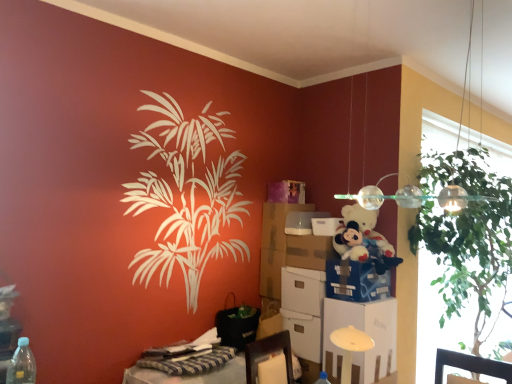
Question: Is brown cardboard box at center-right, marked as the 3th box in a top-to-bottom arrangement, facing towards blue cardboard box at center, the third box in the bottom-to-top sequence?

Choices:
 (A) no
 (B) yes

Answer: (A)

Question: Is blue cardboard box at center, which appears as the fourth box when viewed from the top, completely or partially inside brown cardboard box at center-right, marked as the 3th box in a top-to-bottom arrangement?

Choices:
 (A) no
 (B) yes

Answer: (A)

Question: Is brown cardboard box at center-right, arranged as the 4th box when ordered from the bottom, to the right of blue cardboard box at center, the third box in the bottom-to-top sequence, from the viewer's perspective?

Choices:
 (A) yes
 (B) no

Answer: (B)

Question: Considering the relative sizes of brown cardboard box at center-right, arranged as the 4th box when ordered from the bottom, and blue cardboard box at center, which appears as the fourth box when viewed from the top, in the image provided, is brown cardboard box at center-right, arranged as the 4th box when ordered from the bottom, shorter than blue cardboard box at center, which appears as the fourth box when viewed from the top,?

Choices:
 (A) yes
 (B) no

Answer: (A)

Question: Are brown cardboard box at center-right, arranged as the 4th box when ordered from the bottom, and blue cardboard box at center, the third box in the bottom-to-top sequence, far apart?

Choices:
 (A) no
 (B) yes

Answer: (A)

Question: Would you say fluffy white teddy bear at upper right is to the left or to the right of striped fabric desk at lower left in the picture?

Choices:
 (A) right
 (B) left

Answer: (A)

Question: From the image's perspective, is fluffy white teddy bear at upper right located above or below striped fabric desk at lower left?

Choices:
 (A) below
 (B) above

Answer: (B)

Question: From their relative heights in the image, would you say fluffy white teddy bear at upper right is taller or shorter than striped fabric desk at lower left?

Choices:
 (A) tall
 (B) short

Answer: (A)

Question: Considering their positions, is fluffy white teddy bear at upper right located in front of or behind striped fabric desk at lower left?

Choices:
 (A) behind
 (B) front

Answer: (A)

Question: Does point (278, 248) appear closer or farther from the camera than point (378, 205)?

Choices:
 (A) farther
 (B) closer

Answer: (A)

Question: In the image, is matte cardboard box at center positioned in front of or behind clear glass pendant lights at upper right?

Choices:
 (A) behind
 (B) front

Answer: (A)

Question: From the image's perspective, is matte cardboard box at center positioned above or below clear glass pendant lights at upper right?

Choices:
 (A) below
 (B) above

Answer: (A)

Question: From a real-world perspective, is matte cardboard box at center positioned above or below clear glass pendant lights at upper right?

Choices:
 (A) above
 (B) below

Answer: (B)

Question: In terms of width, does transparent glass window screen at right look wider or thinner when compared to white cardboard box at center, which is the first box from bottom to top?

Choices:
 (A) thin
 (B) wide

Answer: (B)

Question: Is point (426, 147) positioned closer to the camera than point (317, 339)?

Choices:
 (A) farther
 (B) closer

Answer: (A)